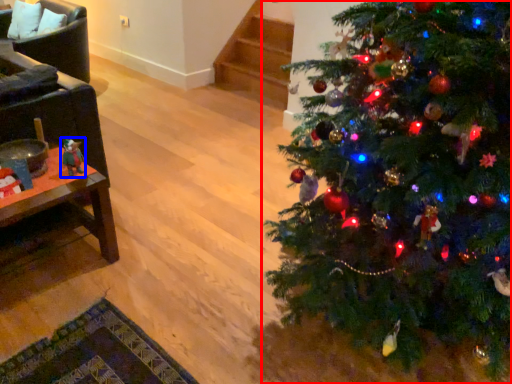
Question: Which object is further to the camera taking this photo, christmas tree (highlighted by a red box) or toy (highlighted by a blue box)?

Choices:
 (A) christmas tree
 (B) toy

Answer: (B)